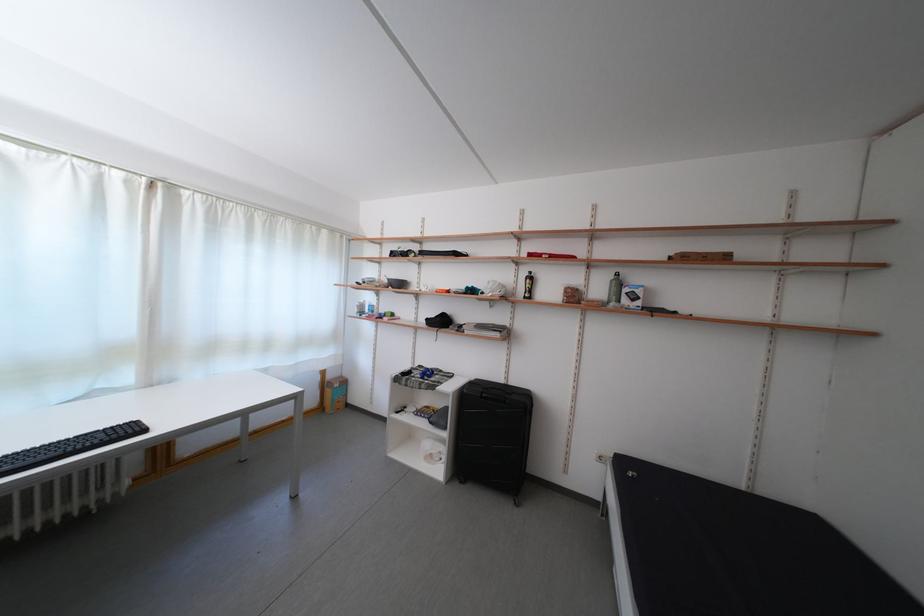
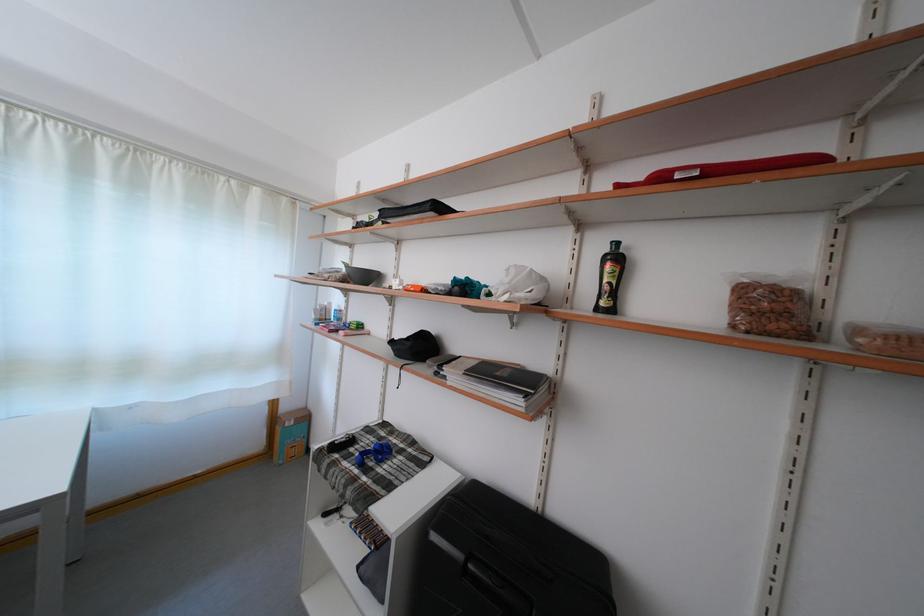
Question: In a continuous first-person perspective shot, in which direction is the camera moving?

Choices:
 (A) Left
 (B) Right
 (C) Forward
 (D) Backward

Answer: (C)